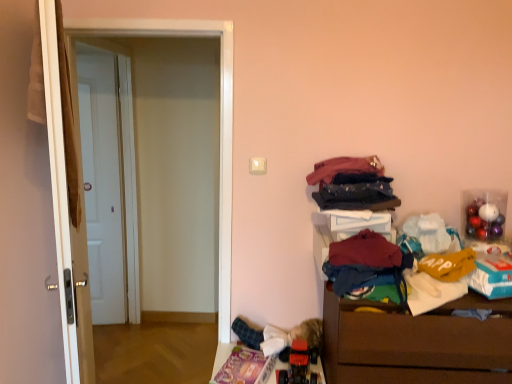
Question: Is dark red fabric at lower right, which appears as the 1th clothing when ordered from the bottom, closer to the viewer compared to white glossy door at left, arranged as the second door when viewed from the back?

Choices:
 (A) no
 (B) yes

Answer: (A)

Question: Are dark red fabric at lower right, arranged as the third clothing when viewed from the top, and white glossy door at left, the 1th door in the right-to-left sequence, making contact?

Choices:
 (A) no
 (B) yes

Answer: (A)

Question: Can you confirm if dark red fabric at lower right, which appears as the 1th clothing when ordered from the bottom, is wider than white glossy door at left, the 1th door in the right-to-left sequence?

Choices:
 (A) yes
 (B) no

Answer: (A)

Question: From the image's perspective, is dark red fabric at lower right, arranged as the third clothing when viewed from the top, located beneath white glossy door at left, arranged as the second door when viewed from the back?

Choices:
 (A) no
 (B) yes

Answer: (B)

Question: Is dark red fabric at lower right, which appears as the 1th clothing when ordered from the bottom, positioned behind white glossy door at left, the 1th door in the right-to-left sequence?

Choices:
 (A) yes
 (B) no

Answer: (A)

Question: Which is correct: dark blue denim jeans at upper right, which is the 1th clothing from top to bottom, is inside brown wooden chest of drawers at lower right, or outside of it?

Choices:
 (A) inside
 (B) outside

Answer: (B)

Question: Is dark blue denim jeans at upper right, positioned as the third clothing in bottom-to-top order, taller or shorter than brown wooden chest of drawers at lower right?

Choices:
 (A) short
 (B) tall

Answer: (A)

Question: Considering the positions of dark blue denim jeans at upper right, positioned as the third clothing in bottom-to-top order, and brown wooden chest of drawers at lower right in the image, is dark blue denim jeans at upper right, positioned as the third clothing in bottom-to-top order, wider or thinner than brown wooden chest of drawers at lower right?

Choices:
 (A) thin
 (B) wide

Answer: (A)

Question: Is dark blue denim jeans at upper right, positioned as the third clothing in bottom-to-top order, bigger or smaller than brown wooden chest of drawers at lower right?

Choices:
 (A) big
 (B) small

Answer: (B)

Question: Based on their sizes in the image, would you say dark red fabric at lower right, arranged as the third clothing when viewed from the top, is bigger or smaller than dark blue fabric at upper right, the second clothing ordered from the bottom?

Choices:
 (A) small
 (B) big

Answer: (B)

Question: Considering the positions of point (364, 256) and point (349, 188), is point (364, 256) closer or farther from the camera than point (349, 188)?

Choices:
 (A) closer
 (B) farther

Answer: (A)

Question: Considering their positions, is dark red fabric at lower right, arranged as the third clothing when viewed from the top, located in front of or behind dark blue fabric at upper right, positioned as the 2th clothing in top-to-bottom order?

Choices:
 (A) front
 (B) behind

Answer: (A)

Question: Is dark red fabric at lower right, which appears as the 1th clothing when ordered from the bottom, taller or shorter than dark blue fabric at upper right, positioned as the 2th clothing in top-to-bottom order?

Choices:
 (A) short
 (B) tall

Answer: (B)

Question: Is white glossy door at left situated inside dark red fabric at lower right, arranged as the third clothing when viewed from the top, or outside?

Choices:
 (A) outside
 (B) inside

Answer: (A)

Question: From the image's perspective, relative to dark red fabric at lower right, arranged as the third clothing when viewed from the top, is white glossy door at left above or below?

Choices:
 (A) below
 (B) above

Answer: (B)